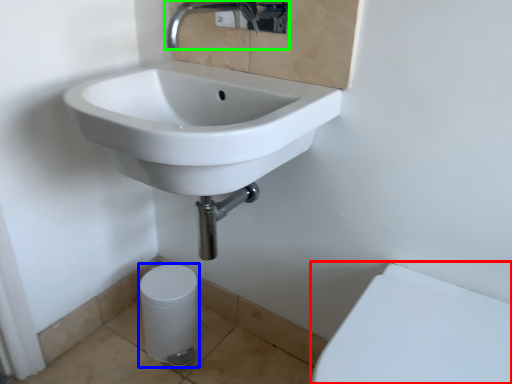
Question: Which is farther away from porcelain (highlighted by a red box)? porcelain (highlighted by a blue box) or tap (highlighted by a green box)?

Choices:
 (A) porcelain
 (B) tap

Answer: (B)